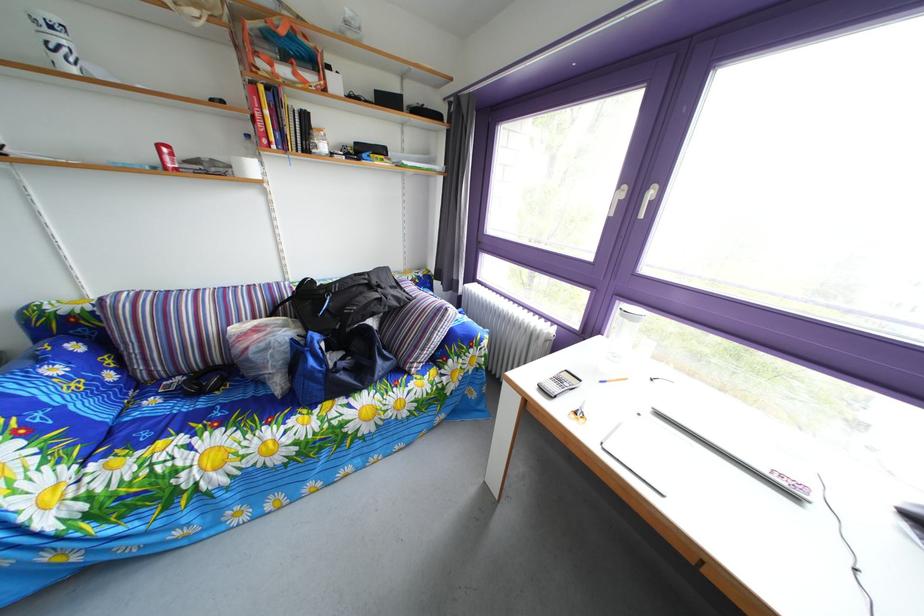
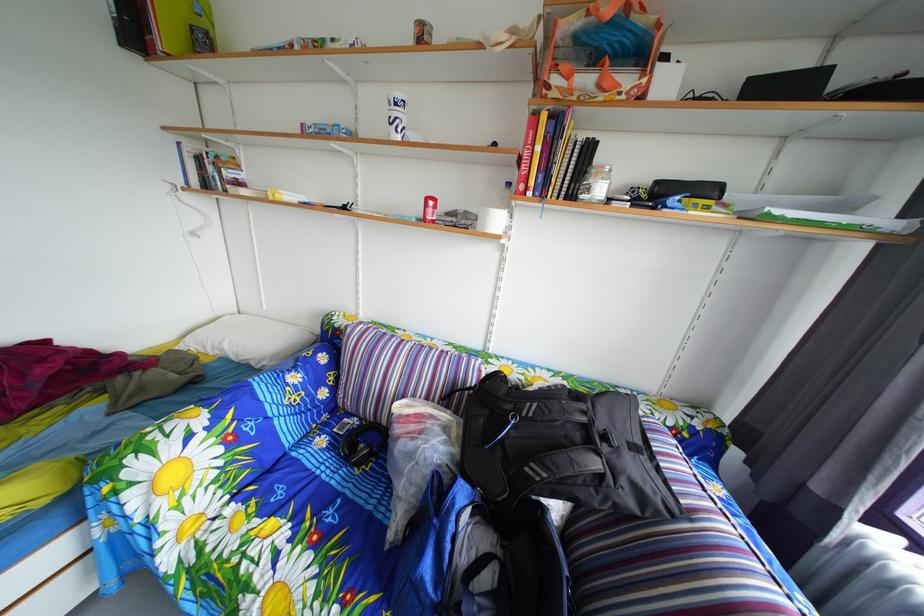
Where in the second image is the point corresponding to point (327, 156) from the first image?

(600, 198)